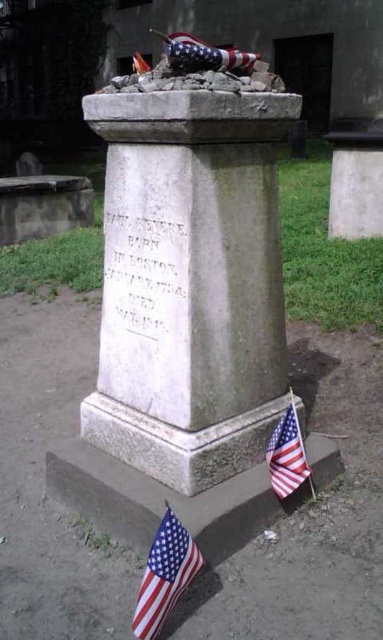
Is point (155, 554) positioned after point (139, 52)?

That is False.

Between point (180, 545) and point (142, 58), which one is positioned in front?

Point (180, 545) is in front.

Where is `american flag at lower left`? american flag at lower left is located at coordinates (165, 576).

Can you confirm if white stone monument at center is positioned above american flag at top?

No, white stone monument at center is not above american flag at top.

Who is more distant from viewer, (145, 252) or (201, 61)?

The point (145, 252) is behind.

This screenshot has height=640, width=383. I want to click on white stone monument at center, so click(189, 273).

Who is higher up, american flag at lower right or red fabric flag at upper center?

red fabric flag at upper center

This screenshot has width=383, height=640. Describe the element at coordinates (288, 454) in the screenshot. I see `american flag at lower right` at that location.

This screenshot has height=640, width=383. What do you see at coordinates (288, 454) in the screenshot?
I see `american flag at lower right` at bounding box center [288, 454].

Identify the location of american flag at lower right. (288, 454).